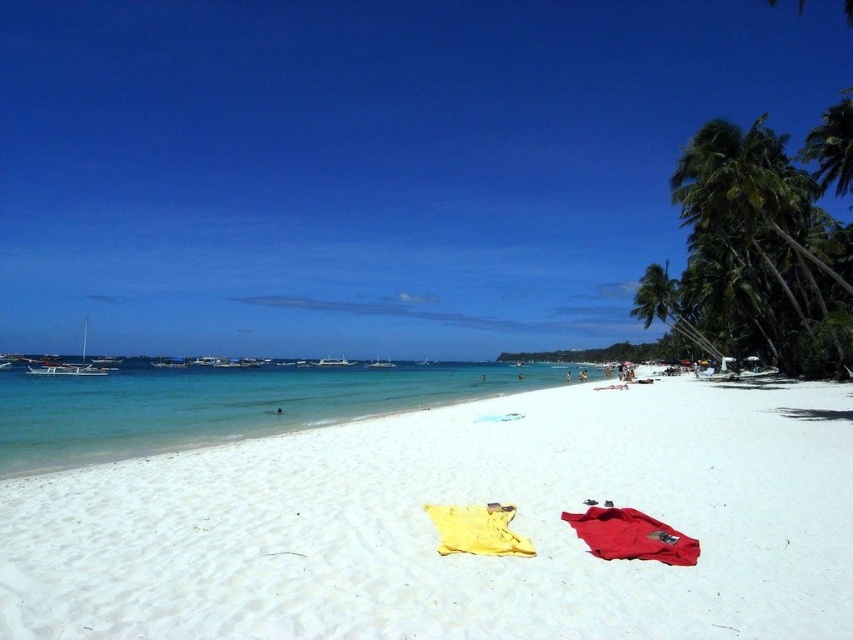
Does clear blue water at center have a larger size compared to matte red towel at lower right?

Yes, clear blue water at center is bigger than matte red towel at lower right.

Who is shorter, clear blue water at center or matte red towel at lower right?

Standing shorter between the two is matte red towel at lower right.

Does point (454, 365) come in front of point (683, 544)?

No, (454, 365) is further to viewer.

You are a GUI agent. You are given a task and a screenshot of the screen. Output one action in this format:
    pyautogui.click(x=<x>, y=<y>)
    Task: Click on the clear blue water at center
    The image size is (853, 640).
    Given the screenshot: What is the action you would take?
    pyautogui.click(x=223, y=404)

Does green leafy palm tree at right appear on the left side of matte red towel at lower right?

In fact, green leafy palm tree at right is to the right of matte red towel at lower right.

Which is behind, point (721, 308) or point (637, 534)?

Point (721, 308)

Does point (730, 216) lie in front of point (630, 548)?

No, it is behind (630, 548).

Where is `green leafy palm tree at right`? green leafy palm tree at right is located at coordinates (757, 243).

Is white sandy beach at center further to camera compared to matte red towel at lower right?

That is False.

Can you confirm if white sandy beach at center is taller than matte red towel at lower right?

Yes, white sandy beach at center is taller than matte red towel at lower right.

Locate an element on the screen. This screenshot has width=853, height=640. white sandy beach at center is located at coordinates (434, 531).